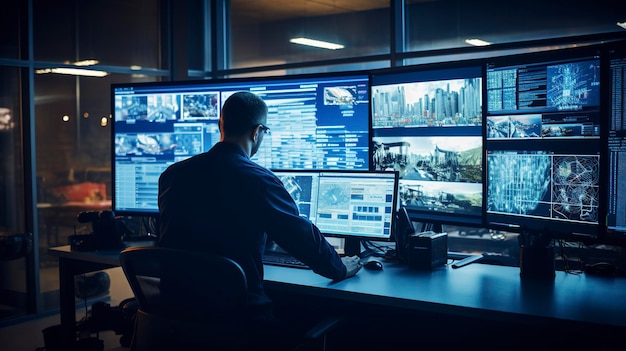
Locate an element on the screen. The width and height of the screenshot is (626, 351). screens is located at coordinates [141, 136], [331, 127], [346, 203], [304, 190], [444, 107], [439, 161], [439, 193], [524, 95], [543, 182].